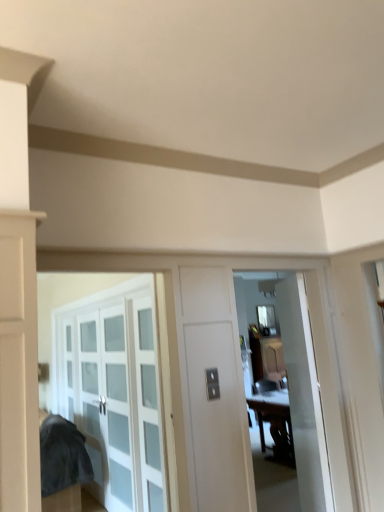
Locate an element on the screen. The image size is (384, 512). clear glass window at center is located at coordinates (266, 319).

What is the approximate height of white glossy door at center?

white glossy door at center is 6.64 feet in height.

This screenshot has width=384, height=512. What are the coordinates of `wooden table at center` in the screenshot? It's located at (275, 422).

The height and width of the screenshot is (512, 384). Describe the element at coordinates (275, 422) in the screenshot. I see `wooden table at center` at that location.

Measure the distance between point (130, 402) and camera.

Point (130, 402) is 3.56 meters from camera.

Locate an element on the screen. clear glass window at center is located at coordinates (266, 319).

Consider the image. Which is more to the left, clear glass cabinet at left or white glossy door at center?

clear glass cabinet at left.

Can you tell me how much clear glass cabinet at left and white glossy door at center differ in facing direction?

29.7 degrees.

Where is `glass door lying below the white glossy door at center (from the image's perspective)`? glass door lying below the white glossy door at center (from the image's perspective) is located at coordinates (107, 405).

Is point (301, 279) behind point (275, 320)?

No, it is in front of (275, 320).

Is white glossy door at center with clear glass window at center?

white glossy door at center and clear glass window at center are not in contact.

Considering the positions of objects white glossy door at center and clear glass window at center in the image provided, who is in front, white glossy door at center or clear glass window at center?

white glossy door at center.

From the image's perspective, which is above, white glossy door at center or clear glass window at center?

white glossy door at center.

From the image's perspective, is clear glass cabinet at left positioned above or below clear glass window at center?

Clearly, from the image's perspective, clear glass cabinet at left is below clear glass window at center.

Who is taller, clear glass cabinet at left or clear glass window at center?

With more height is clear glass cabinet at left.

Could you tell me if clear glass cabinet at left is turned towards clear glass window at center?

No, clear glass cabinet at left is not facing towards clear glass window at center.

From a real-world perspective, is clear glass cabinet at left located beneath clear glass window at center?

Correct, in the physical world, clear glass cabinet at left is lower than clear glass window at center.

How much distance is there between wooden table at center and white glossy door at center?

wooden table at center and white glossy door at center are 7.57 feet apart.

From the image's perspective, which object appears higher, wooden table at center or white glossy door at center?

white glossy door at center is shown above in the image.

Is wooden table at center not inside white glossy door at center?

Yes, wooden table at center is not within white glossy door at center.

Is point (279, 393) in front of point (317, 422)?

That is False.

Looking at their sizes, would you say clear glass window at center is wider or thinner than wooden table at center?

In the image, clear glass window at center appears to be more narrow than wooden table at center.

From the picture: Would you say clear glass window at center contains wooden table at center?

Definitely not — wooden table at center is not inside clear glass window at center.

Considering the relative sizes of clear glass window at center and wooden table at center in the image provided, is clear glass window at center smaller than wooden table at center?

Indeed, clear glass window at center has a smaller size compared to wooden table at center.

From a real-world perspective, who is located higher, clear glass window at center or wooden table at center?

In real-world perspective, clear glass window at center is above.

What's the angular difference between clear glass window at center and clear glass cabinet at left's facing directions?

90.2 degrees separate the facing orientations of clear glass window at center and clear glass cabinet at left.

Who is bigger, clear glass window at center or clear glass cabinet at left?

Bigger between the two is clear glass cabinet at left.

Is clear glass window at center taller than clear glass cabinet at left?

In fact, clear glass window at center may be shorter than clear glass cabinet at left.

Which object is thinner, wooden table at center or clear glass window at center?

clear glass window at center.

Is wooden table at center turned away from clear glass window at center?

No, wooden table at center is not facing the opposite direction of clear glass window at center.

Looking at this image, which is correct: wooden table at center is inside clear glass window at center, or outside of it?

wooden table at center is located beyond the bounds of clear glass window at center.

Is wooden table at center in contact with clear glass window at center?

wooden table at center and clear glass window at center are not in contact.

Locate an element on the screen. door that is above the clear glass cabinet at left (from a real-world perspective) is located at coordinates (304, 396).

The image size is (384, 512). In the image, there is a clear glass window at center. What are the coordinates of `door below it (from a real-world perspective)` in the screenshot? It's located at (304, 396).

Which object lies nearer to the anchor point white glossy door at center, clear glass window at center or wooden table at center?

wooden table at center is closer to white glossy door at center.

From the image, which object appears to be farther from clear glass cabinet at left, white glossy door at center or wooden table at center?

Based on the image, wooden table at center appears to be further to clear glass cabinet at left.

From the image, which object appears to be nearer to white glossy door at center, clear glass cabinet at left or wooden table at center?

clear glass cabinet at left is closer to white glossy door at center.

When comparing their distances from white glossy door at center, does wooden table at center or clear glass window at center seem closer?

wooden table at center lies closer to white glossy door at center than the other object.

When comparing their distances from clear glass window at center, does white glossy door at center or clear glass cabinet at left seem further?

white glossy door at center lies further to clear glass window at center than the other object.

When comparing their distances from clear glass cabinet at left, does clear glass window at center or wooden table at center seem closer?

wooden table at center is positioned closer to the anchor clear glass cabinet at left.

When comparing their distances from clear glass cabinet at left, does wooden table at center or clear glass window at center seem closer?

wooden table at center.

Considering their positions, is clear glass window at center positioned closer to white glossy door at center than clear glass cabinet at left?

clear glass cabinet at left is closer to white glossy door at center.

At what (x,y) coordinates should I click in order to perform the action: click on table positioned between white glossy door at center and clear glass window at center from near to far. Please return your answer as a coordinate pair (x, y). This screenshot has height=512, width=384. Looking at the image, I should click on (275, 422).

Find the location of a particular element. This screenshot has width=384, height=512. glass door located between white glossy door at center and clear glass window at center in the depth direction is located at coordinates (107, 405).

The image size is (384, 512). In order to click on door between clear glass cabinet at left and wooden table at center in this screenshot , I will do `click(304, 396)`.

Image resolution: width=384 pixels, height=512 pixels. Identify the location of table between clear glass cabinet at left and clear glass window at center along the z-axis. (275, 422).